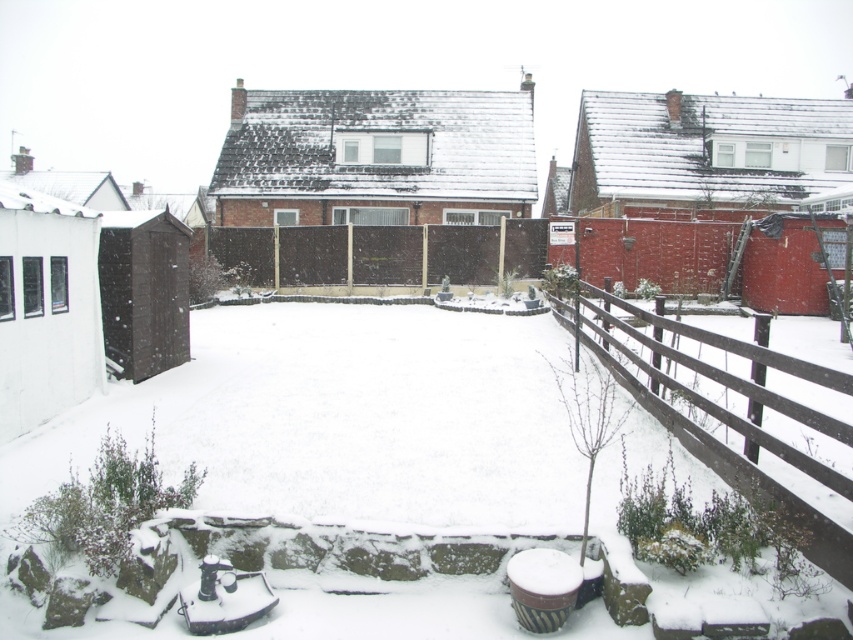
Is brown wooden fence at lower right taller than brown wooden fence at center?

No, brown wooden fence at lower right is not taller than brown wooden fence at center.

Does brown wooden fence at lower right appear on the right side of brown wooden fence at center?

Yes, brown wooden fence at lower right is to the right of brown wooden fence at center.

The image size is (853, 640). Describe the element at coordinates (737, 417) in the screenshot. I see `brown wooden fence at lower right` at that location.

Where is `brown wooden fence at lower right`? brown wooden fence at lower right is located at coordinates (x=737, y=417).